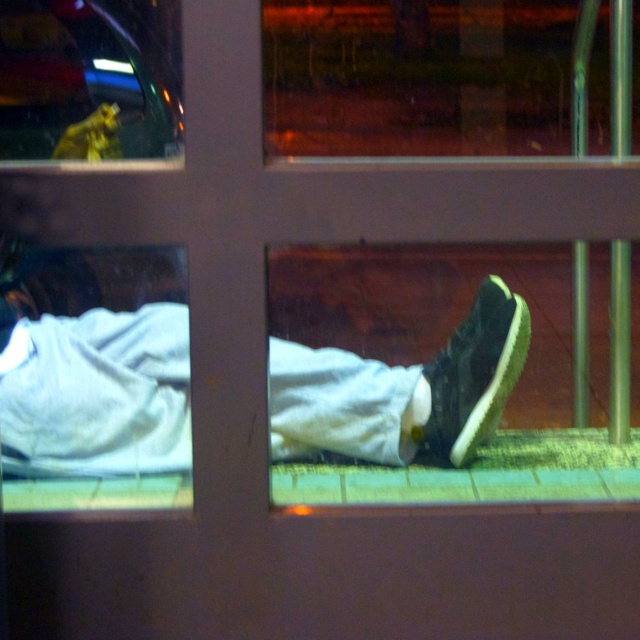
Question: Can you confirm if white matte pants at lower center is positioned below clear glass window at upper left?

Choices:
 (A) no
 (B) yes

Answer: (B)

Question: Which point appears farthest from the camera in this image?

Choices:
 (A) (486, 300)
 (B) (56, 68)
 (C) (154, 436)

Answer: (B)

Question: Which object is positioned closest to the clear glass window at upper left?

Choices:
 (A) white matte pants at lower center
 (B) black suede shoe at lower right

Answer: (A)

Question: Does clear glass window at upper left have a greater width compared to black suede shoe at lower right?

Choices:
 (A) no
 (B) yes

Answer: (B)

Question: Which object appears farthest from the camera in this image?

Choices:
 (A) black suede shoe at lower right
 (B) white matte pants at lower center
 (C) clear glass window at upper left

Answer: (C)

Question: From the image, what is the correct spatial relationship of white matte pants at lower center in relation to clear glass window at upper left?

Choices:
 (A) below
 (B) above

Answer: (A)